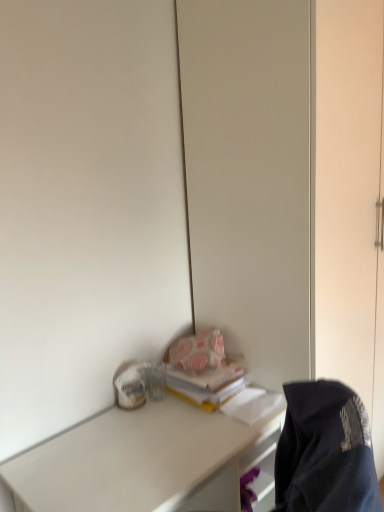
Question: From a real-world perspective, is yellow matte book at center positioned over white matte desk at lower left based on gravity?

Choices:
 (A) yes
 (B) no

Answer: (A)

Question: Is yellow matte book at center facing towards white matte desk at lower left?

Choices:
 (A) no
 (B) yes

Answer: (A)

Question: Does yellow matte book at center appear on the right side of white matte desk at lower left?

Choices:
 (A) yes
 (B) no

Answer: (A)

Question: Is yellow matte book at center behind white matte desk at lower left?

Choices:
 (A) no
 (B) yes

Answer: (B)

Question: Is yellow matte book at center smaller than white matte desk at lower left?

Choices:
 (A) no
 (B) yes

Answer: (B)

Question: Is yellow matte book at center taller than white matte desk at lower left?

Choices:
 (A) yes
 (B) no

Answer: (B)

Question: From the image's perspective, would you say dark blue fabric jacket at lower right is positioned over yellow matte book at center?

Choices:
 (A) no
 (B) yes

Answer: (A)

Question: From a real-world perspective, is dark blue fabric jacket at lower right beneath yellow matte book at center?

Choices:
 (A) no
 (B) yes

Answer: (B)

Question: From the image's perspective, is dark blue fabric jacket at lower right located beneath yellow matte book at center?

Choices:
 (A) no
 (B) yes

Answer: (B)

Question: Could you tell me if dark blue fabric jacket at lower right is turned towards yellow matte book at center?

Choices:
 (A) no
 (B) yes

Answer: (A)

Question: Is dark blue fabric jacket at lower right bigger than yellow matte book at center?

Choices:
 (A) yes
 (B) no

Answer: (A)

Question: Is dark blue fabric jacket at lower right at the left side of yellow matte book at center?

Choices:
 (A) yes
 (B) no

Answer: (B)

Question: Is white matte desk at lower left not close to dark blue fabric jacket at lower right?

Choices:
 (A) yes
 (B) no

Answer: (B)